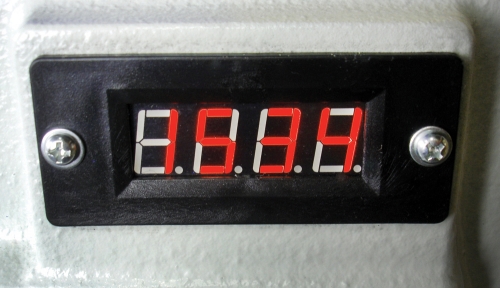
Identify the location of black rectangular panel. (105, 190).